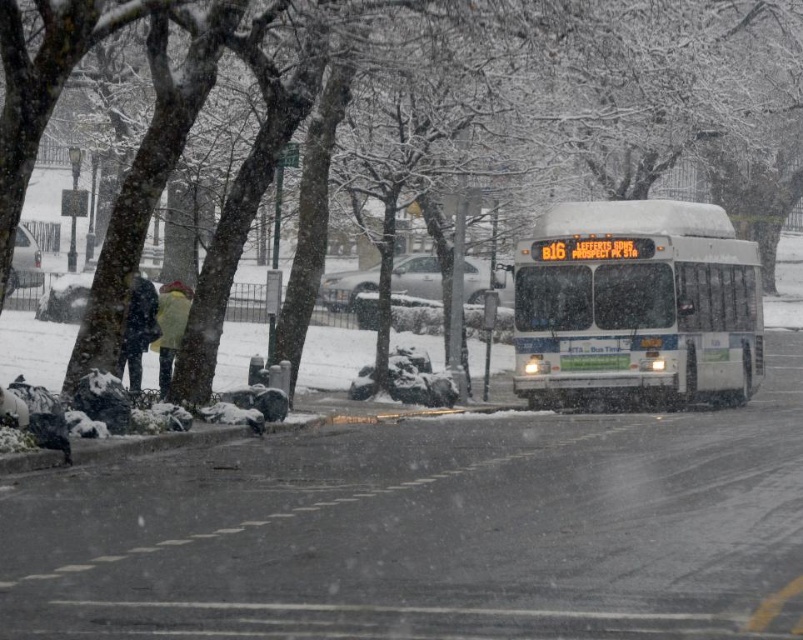
Between point (139, 355) and point (170, 337), which one is positioned in front?

Positioned in front is point (139, 355).

Consider the image. Measure the distance between point (141, 348) and camera.

A distance of 70.80 feet exists between point (141, 348) and camera.

Locate an element on the screen. dark blue jacket at center is located at coordinates (137, 328).

Who is positioned more to the left, white matte bus at center or yellow wool coat at left?

yellow wool coat at left is more to the left.

Does white matte bus at center appear under yellow wool coat at left?

No.

Is point (691, 348) less distant than point (174, 337)?

That is False.

Identify the location of white matte bus at center. (636, 304).

Is point (748, 355) farther from viewer compared to point (141, 362)?

That is True.

In order to click on white matte bus at center in this screenshot , I will do `click(636, 304)`.